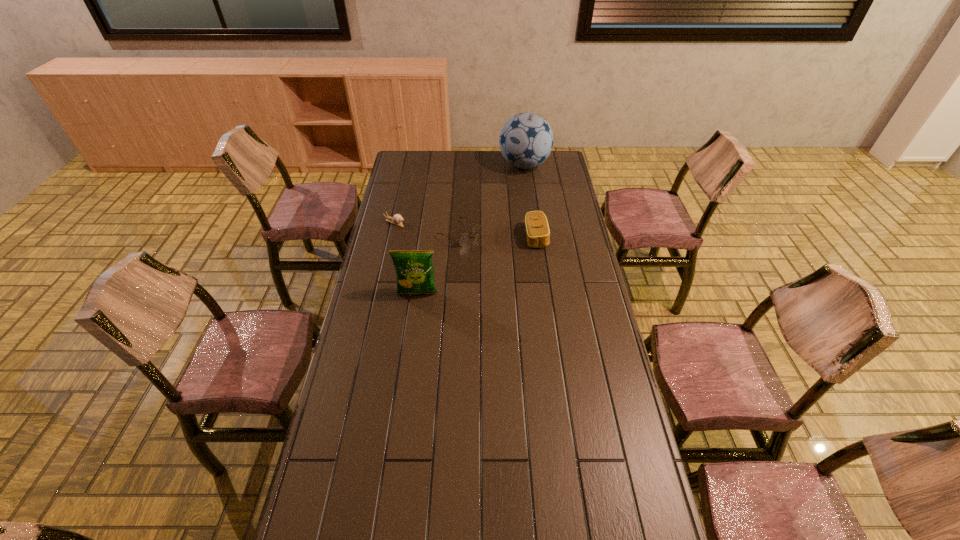
At what (x,y) coordinates should I click in order to perform the action: click on the fourth shortest object. Please return your answer as a coordinate pair (x, y). Image resolution: width=960 pixels, height=540 pixels. Looking at the image, I should click on (415, 275).

This screenshot has width=960, height=540. I want to click on the nearest object, so click(x=415, y=275).

I want to click on the third shortest object, so click(x=537, y=230).

Locate an element on the screen. sunglasses is located at coordinates (463, 240).

You are a GUI agent. You are given a task and a screenshot of the screen. Output one action in this format:
    pyautogui.click(x=<x>, y=<y>)
    Task: Click on the farthest object
    This screenshot has width=960, height=540.
    Given the screenshot: What is the action you would take?
    pyautogui.click(x=526, y=140)

This screenshot has height=540, width=960. Identify the location of the tallest object. (x=526, y=140).

Where is `the leftmost object`? The image size is (960, 540). the leftmost object is located at coordinates (397, 219).

This screenshot has width=960, height=540. Find the location of `escargot`. escargot is located at coordinates (397, 219).

Locate an element on the screen. free space located on the front-facing side of the nearest object is located at coordinates (411, 340).

At what (x,y) coordinates should I click in order to perform the action: click on vacant space situated 0.130m on the zipper side of the clutch bag. Please return your answer as a coordinate pair (x, y). The height and width of the screenshot is (540, 960). Looking at the image, I should click on pos(577,237).